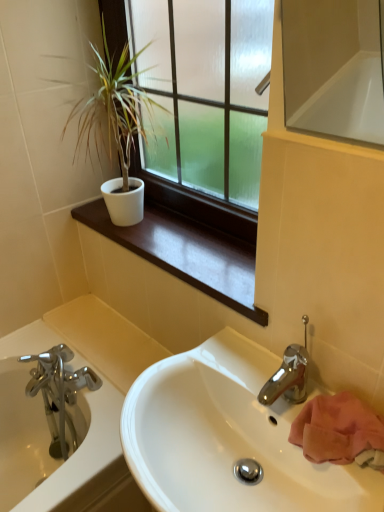
Question: Considering the positions of point (211, 66) and point (74, 157), is point (211, 66) closer or farther from the camera than point (74, 157)?

Choices:
 (A) closer
 (B) farther

Answer: (A)

Question: From the image's perspective, is matte glass window at upper center located above or below white matte pot at upper left?

Choices:
 (A) below
 (B) above

Answer: (A)

Question: Estimate the real-world distances between objects in this image. Which object is closer to the white glossy sink at center?

Choices:
 (A) brushed metal bathtub at lower left
 (B) white matte window sill at upper center
 (C) matte glass window at upper center
 (D) white matte pot at upper left

Answer: (B)

Question: Considering the real-world distances, which object is closest to the white matte pot at upper left?

Choices:
 (A) white glossy sink at center
 (B) brushed metal bathtub at lower left
 (C) matte glass window at upper center
 (D) white matte window sill at upper center

Answer: (C)